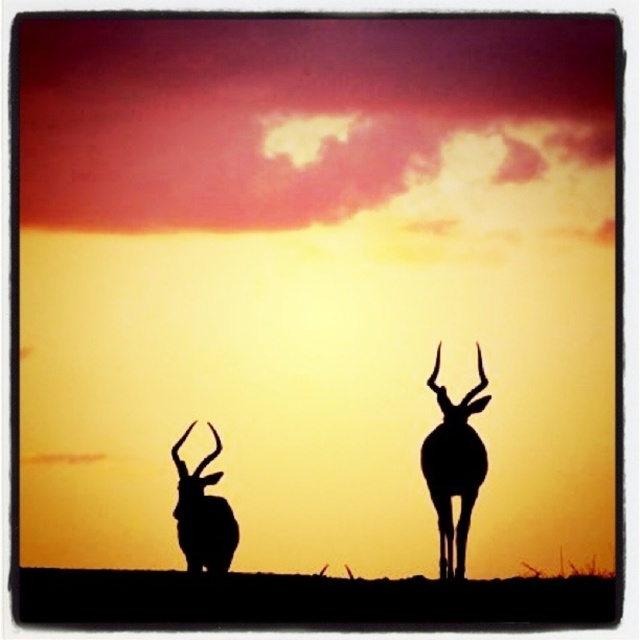
Does silhouette antelope at center appear over black matte/deer at left?

Correct, silhouette antelope at center is located above black matte/deer at left.

Is silhouette antelope at center bigger than black matte/deer at left?

Yes, silhouette antelope at center is bigger than black matte/deer at left.

Which is behind, point (464, 541) or point (173, 512)?

Point (173, 512)

Locate an element on the screen. silhouette antelope at center is located at coordinates [x=454, y=465].